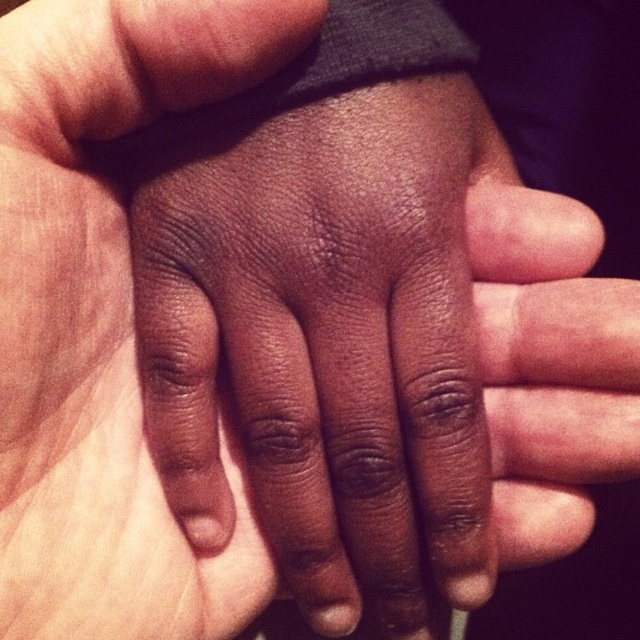
You are a dermatologist examining the image of two hands. You notice the dry skin at center and the dark skin palm at center. Which part of the hand is more elevated in the image?

The dry skin at center is positioned over dark skin palm at center, so the dry skin at center is more elevated.

You are a dermatologist examining the image. You notice two areas of concern at the center of the image. The first is the dry skin at center, and the second is the dark skin palm at center. Based on their positions, which area is located to the right side of the other?

The dry skin at center is located to the right of the dark skin palm at center.